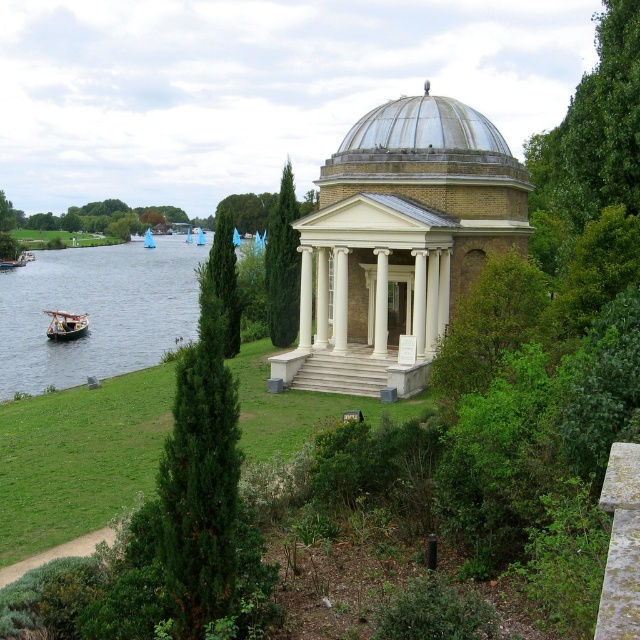
You are an architect designing a new pathway that must pass between the green textured tree at center and the blue sailboat at center. Based on their positions, in which direction should the pathway be constructed to avoid both objects?

The pathway should be constructed above both the green textured tree at center and the blue sailboat at center since the green textured tree at center is positioned below the blue sailboat at center.

You are standing at the riverside and want to cross to the other side. You see the brushed metal water at lower left and the wooden polished boat at lower left. Which object should you use to cross the river?

You should use the wooden polished boat at lower left to cross the river because the brushed metal water at lower left is in front of it and not a vessel for crossing.